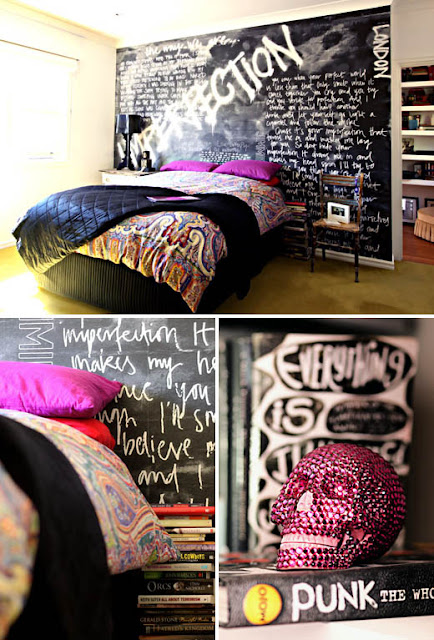
This screenshot has height=640, width=434. I want to click on black lamp, so click(x=125, y=150).